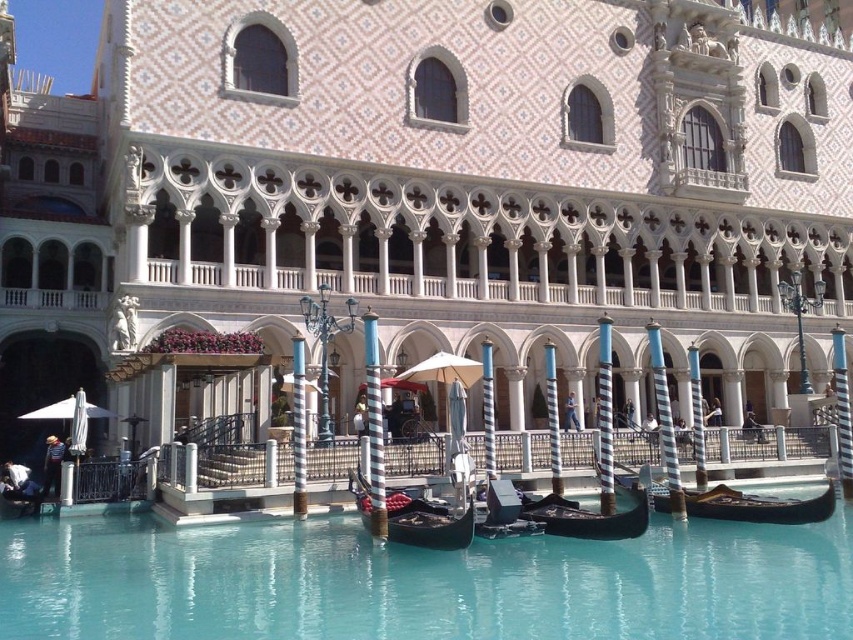
Looking at this image, is striped wood pole at center to the left of metallic gold gondola at center from the viewer's perspective?

Yes, striped wood pole at center is to the left of metallic gold gondola at center.

Where is `striped wood pole at center`? Image resolution: width=853 pixels, height=640 pixels. striped wood pole at center is located at coordinates (374, 426).

Measure the distance between point (198, 467) and camera.

43.18 meters

The image size is (853, 640). What do you see at coordinates (769, 444) in the screenshot? I see `white striped metal rail at center` at bounding box center [769, 444].

Identify the location of white striped metal rail at center. Image resolution: width=853 pixels, height=640 pixels. (769, 444).

Does white striped metal rail at center have a lesser width compared to metallic gold gondola at center?

No.

Between point (251, 476) and point (409, 420), which one is positioned behind?

Point (409, 420)

The width and height of the screenshot is (853, 640). In order to click on white striped metal rail at center in this screenshot , I will do `click(769, 444)`.